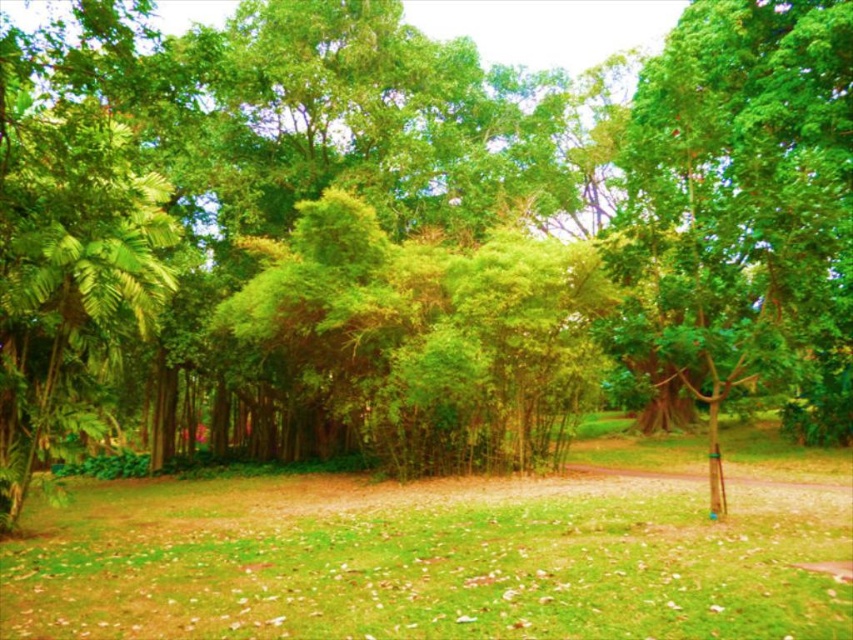
Consider the image. Does green grass at center appear on the left side of green leafy tree at right?

Indeed, green grass at center is positioned on the left side of green leafy tree at right.

Is green grass at center positioned at the back of green leafy tree at right?

No, it is not.

Between point (345, 515) and point (672, 42), which one is positioned behind?

Point (672, 42)

Identify the location of green grass at center. click(x=440, y=557).